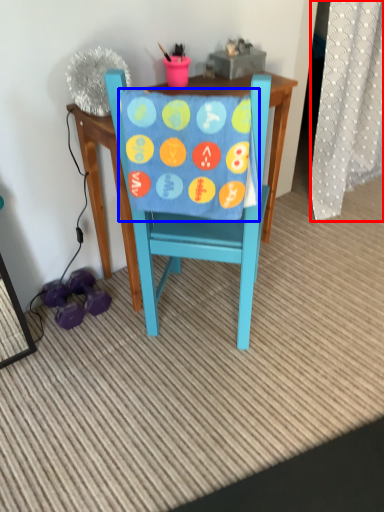
Question: Which point is further to the camera, curtain (highlighted by a red box) or blanket (highlighted by a blue box)?

Choices:
 (A) curtain
 (B) blanket

Answer: (A)